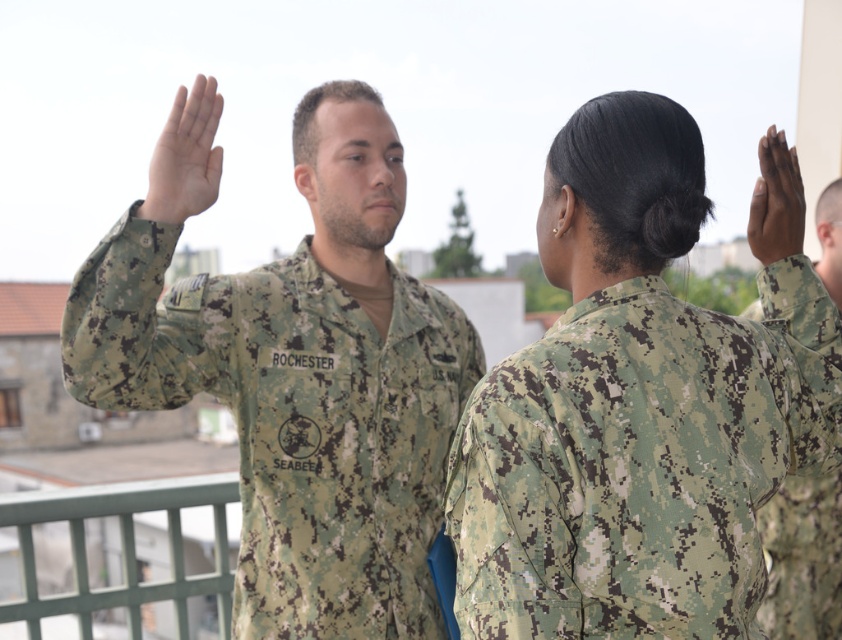
Question: Which object is positioned closest to the matte green uniform at upper center?

Choices:
 (A) camouflage uniform at right
 (B) camouflage uniform at center
 (C) camouflage fabric uniform at center
 (D) dark brown matte skin at upper right

Answer: (B)

Question: Is the position of camouflage uniform at center more distant than that of matte green uniform at upper center?

Choices:
 (A) yes
 (B) no

Answer: (A)

Question: In this image, where is camouflage fabric uniform at center located relative to camouflage uniform at right?

Choices:
 (A) left
 (B) right

Answer: (A)

Question: Does camouflage fabric uniform at center appear under matte green uniform at upper center?

Choices:
 (A) yes
 (B) no

Answer: (A)

Question: Which point is farther to the camera?

Choices:
 (A) (624, 180)
 (B) (214, 200)
 (C) (809, 522)
 (D) (156, 321)

Answer: (C)

Question: Which of the following is the farthest from the observer?

Choices:
 (A) (795, 160)
 (B) (649, 531)

Answer: (A)